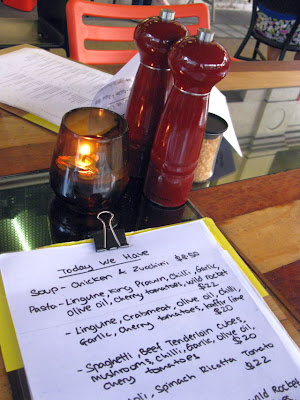
Find the location of `orange plastic chair`. orange plastic chair is located at coordinates (126, 34).